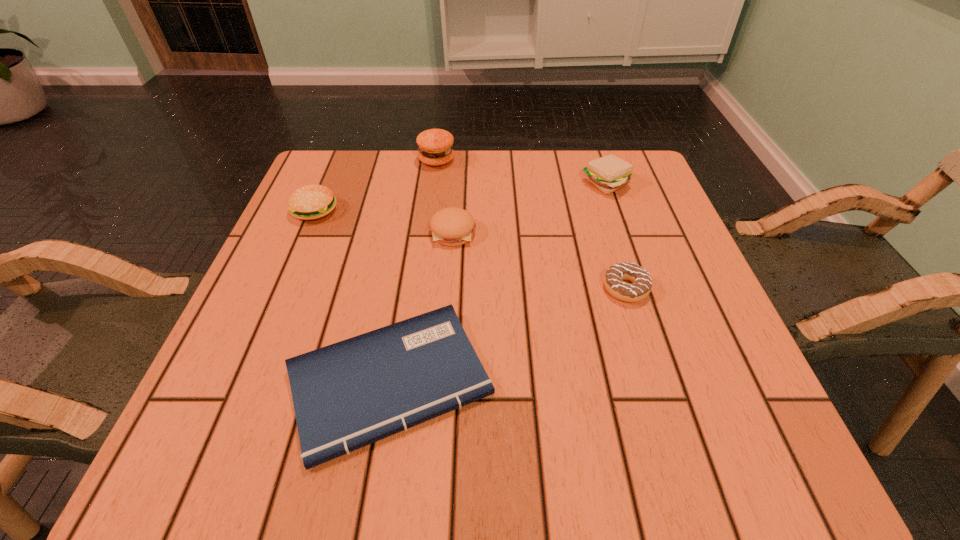
Where is `object located at the far right corner`? Image resolution: width=960 pixels, height=540 pixels. object located at the far right corner is located at coordinates (609, 173).

In the image, there is a desktop. At what (x,y) coordinates should I click in order to perform the action: click on vacant region at the far edge. Please return your answer as a coordinate pair (x, y). The height and width of the screenshot is (540, 960). Looking at the image, I should click on point(501,185).

At what (x,y) coordinates should I click in order to perform the action: click on free space at the near edge of the desktop. Please return your answer as a coordinate pair (x, y). The image size is (960, 540). Looking at the image, I should click on (479, 427).

In the image, there is a desktop. Where is `vacant space at the left edge`? vacant space at the left edge is located at coordinates (337, 207).

In the image, there is a desktop. At what (x,y) coordinates should I click in order to perform the action: click on vacant space at the right edge. Please return your answer as a coordinate pair (x, y). Image resolution: width=960 pixels, height=540 pixels. Looking at the image, I should click on (664, 222).

The height and width of the screenshot is (540, 960). I want to click on free space between the farthest patty and the rightmost patty, so click(x=521, y=172).

You are a GUI agent. You are given a task and a screenshot of the screen. Output one action in this format:
    pyautogui.click(x=<x>, y=<y>)
    Task: Click on the free space between the tallest patty and the rightmost patty
    The height and width of the screenshot is (540, 960).
    Given the screenshot: What is the action you would take?
    pyautogui.click(x=521, y=172)

Find the location of a particular element. This screenshot has width=960, height=540. unoccupied position between the leftmost object and the rightmost patty is located at coordinates (460, 197).

At what (x,y) coordinates should I click in order to perform the action: click on free space between the leftmost object and the farthest patty. Please return your answer as a coordinate pair (x, y). The width and height of the screenshot is (960, 540). Looking at the image, I should click on (375, 185).

This screenshot has width=960, height=540. Identify the location of vacant area that lies between the farthest object and the paperback book. (413, 271).